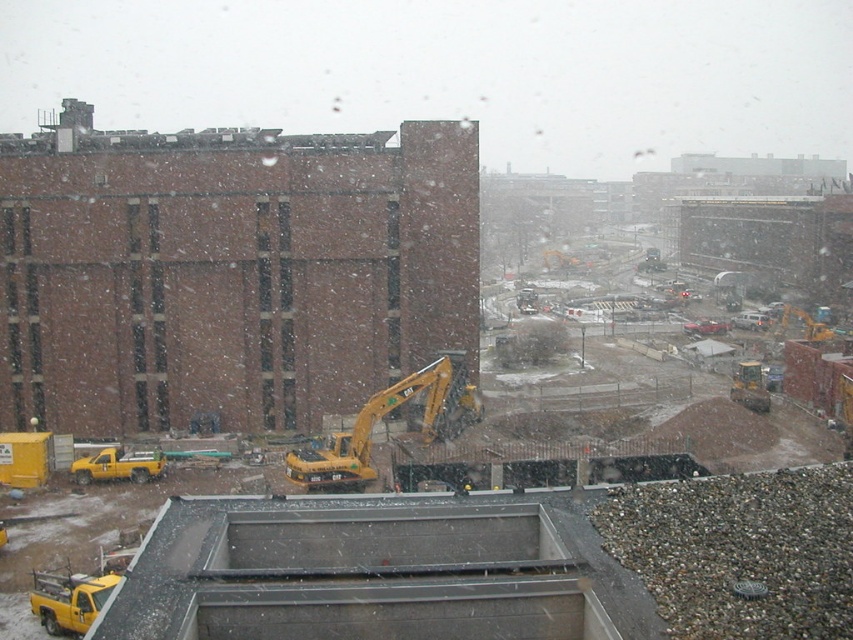
Question: Which of these objects is positioned closest to the yellow rubber tractor at lower right?

Choices:
 (A) yellow rubber excavator at center
 (B) brick building at left
 (C) yellow matte truck at lower left
 (D) matte yellow truck at lower left

Answer: (A)

Question: Does yellow rubber excavator at center have a larger size compared to yellow rubber tractor at lower right?

Choices:
 (A) yes
 (B) no

Answer: (A)

Question: Which of the following is the farthest from the observer?

Choices:
 (A) (738, 381)
 (B) (96, 456)
 (C) (369, 468)

Answer: (A)

Question: Can you confirm if yellow matte truck at lower left is positioned below yellow rubber tractor at lower right?

Choices:
 (A) yes
 (B) no

Answer: (A)

Question: Considering the relative positions of matte yellow truck at lower left and yellow matte truck at lower left in the image provided, where is matte yellow truck at lower left located with respect to yellow matte truck at lower left?

Choices:
 (A) above
 (B) below

Answer: (B)

Question: Which point is farther to the camera?

Choices:
 (A) (90, 605)
 (B) (729, 390)
 (C) (12, 381)
 (D) (405, 397)

Answer: (B)